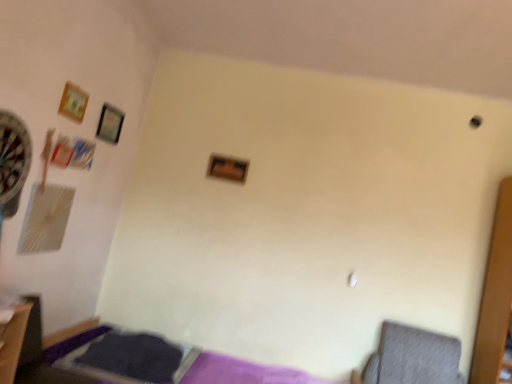
Question: Considering the relative sizes of gray fabric swivel chair at lower right and wooden frame at center, positioned as the third picture frame in front-to-back order, in the image provided, is gray fabric swivel chair at lower right thinner than wooden frame at center, positioned as the third picture frame in front-to-back order,?

Choices:
 (A) no
 (B) yes

Answer: (A)

Question: From a real-world perspective, is gray fabric swivel chair at lower right on wooden frame at center, positioned as the third picture frame in front-to-back order?

Choices:
 (A) no
 (B) yes

Answer: (A)

Question: Is the position of gray fabric swivel chair at lower right less distant than that of wooden frame at center, marked as the 1th picture frame in a right-to-left arrangement?

Choices:
 (A) no
 (B) yes

Answer: (B)

Question: Is wooden frame at center, marked as the 1th picture frame in a right-to-left arrangement, located within gray fabric swivel chair at lower right?

Choices:
 (A) no
 (B) yes

Answer: (A)

Question: From the image's perspective, is gray fabric swivel chair at lower right located above wooden frame at center, the first picture frame when ordered from back to front?

Choices:
 (A) no
 (B) yes

Answer: (A)

Question: Does point (75, 119) appear closer or farther from the camera than point (388, 350)?

Choices:
 (A) farther
 (B) closer

Answer: (B)

Question: From the image's perspective, is wooden frame at upper left, the first picture frame positioned from the left, located above or below gray fabric swivel chair at lower right?

Choices:
 (A) below
 (B) above

Answer: (B)

Question: From a real-world perspective, is wooden frame at upper left, the 3th picture frame in the back-to-front sequence, positioned above or below gray fabric swivel chair at lower right?

Choices:
 (A) below
 (B) above

Answer: (B)

Question: Which is correct: wooden frame at upper left, marked as the 1th picture frame in a front-to-back arrangement, is inside gray fabric swivel chair at lower right, or outside of it?

Choices:
 (A) outside
 (B) inside

Answer: (A)

Question: Choose the correct answer: Is purple fabric bed at lower left inside matte black picture frame at upper left, positioned as the second picture frame in left-to-right order, or outside it?

Choices:
 (A) inside
 (B) outside

Answer: (B)

Question: Relative to matte black picture frame at upper left, the second picture frame viewed from the front, is purple fabric bed at lower left in front or behind?

Choices:
 (A) front
 (B) behind

Answer: (A)

Question: From the image's perspective, is purple fabric bed at lower left located above or below matte black picture frame at upper left, the 2th picture frame in the right-to-left sequence?

Choices:
 (A) below
 (B) above

Answer: (A)

Question: Considering the positions of purple fabric bed at lower left and matte black picture frame at upper left, the 2th picture frame in the back-to-front sequence, in the image, is purple fabric bed at lower left taller or shorter than matte black picture frame at upper left, the 2th picture frame in the back-to-front sequence,?

Choices:
 (A) short
 (B) tall

Answer: (B)

Question: From a real-world perspective, is gray fabric swivel chair at lower right above or below wooden frame at upper left, the first picture frame positioned from the left?

Choices:
 (A) below
 (B) above

Answer: (A)

Question: Considering the positions of gray fabric swivel chair at lower right and wooden frame at upper left, acting as the 3th picture frame starting from the right, in the image, is gray fabric swivel chair at lower right wider or thinner than wooden frame at upper left, acting as the 3th picture frame starting from the right,?

Choices:
 (A) thin
 (B) wide

Answer: (B)